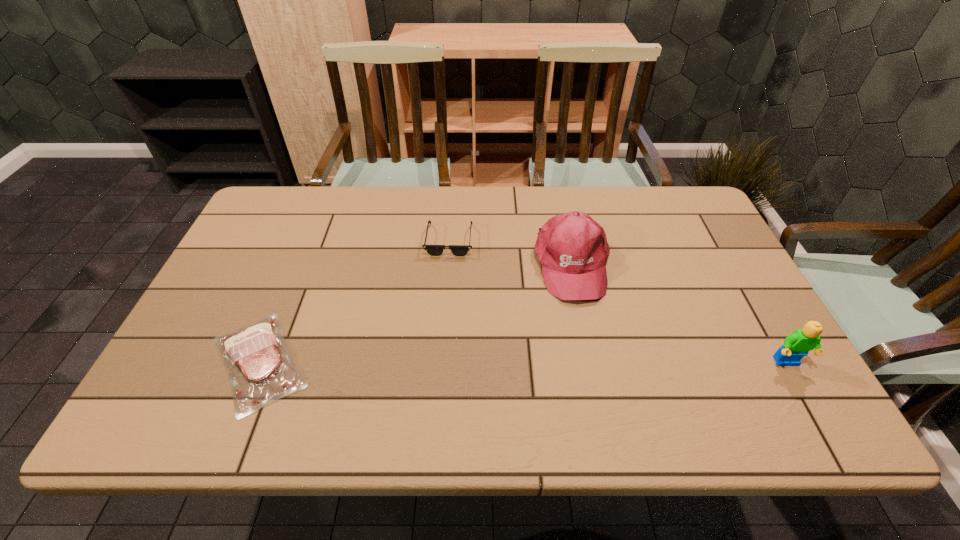
Where is `free space on the desktop that is between the steak and the rightmost object and is positioned on the lenses of the second shortest object`? free space on the desktop that is between the steak and the rightmost object and is positioned on the lenses of the second shortest object is located at coordinates (529, 362).

The image size is (960, 540). Find the location of `free space on the desktop that is between the steak and the Lego and is positioned at the front of the baseball cap with the brim`. free space on the desktop that is between the steak and the Lego and is positioned at the front of the baseball cap with the brim is located at coordinates 595,362.